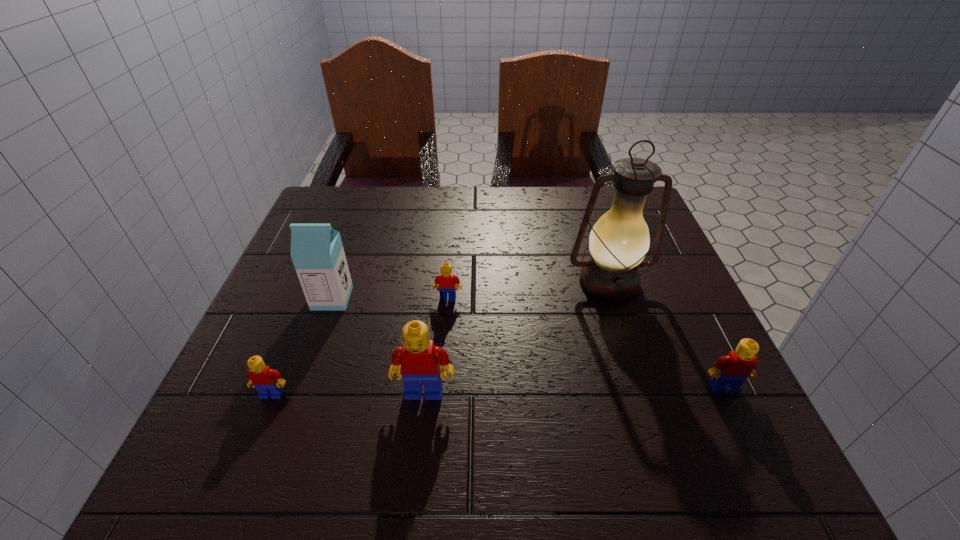
This screenshot has width=960, height=540. In the image, there is a desktop. What are the coordinates of `vacant space at the right edge` in the screenshot? It's located at (665, 303).

At what (x,y) coordinates should I click in order to perform the action: click on vacant space at the far left corner of the desktop. Please return your answer as a coordinate pair (x, y). Image resolution: width=960 pixels, height=540 pixels. Looking at the image, I should click on (310, 220).

In the image, there is a desktop. Find the location of `free space at the far right corner`. free space at the far right corner is located at coordinates (649, 228).

At what (x,y) coordinates should I click in order to perform the action: click on vacant space that is in between the tallest object and the tallest Lego. Please return your answer as a coordinate pair (x, y). Image resolution: width=960 pixels, height=540 pixels. Looking at the image, I should click on (516, 338).

The width and height of the screenshot is (960, 540). I want to click on empty space between the farthest Lego and the tallest Lego, so click(x=436, y=345).

Locate an element on the screen. The height and width of the screenshot is (540, 960). vacant space in between the tallest Lego and the rightmost Lego is located at coordinates (574, 390).

Locate an element on the screen. This screenshot has height=540, width=960. free space between the milk carton and the leftmost Lego is located at coordinates (302, 346).

This screenshot has height=540, width=960. What are the coordinates of `blank region between the milk carton and the leftmost Lego` in the screenshot? It's located at (302, 346).

The image size is (960, 540). Identify the location of free space between the second object from right to left and the tallest Lego. click(516, 338).

What are the coordinates of `vacant space that is in between the third shortest object and the farthest Lego` in the screenshot? It's located at click(586, 343).